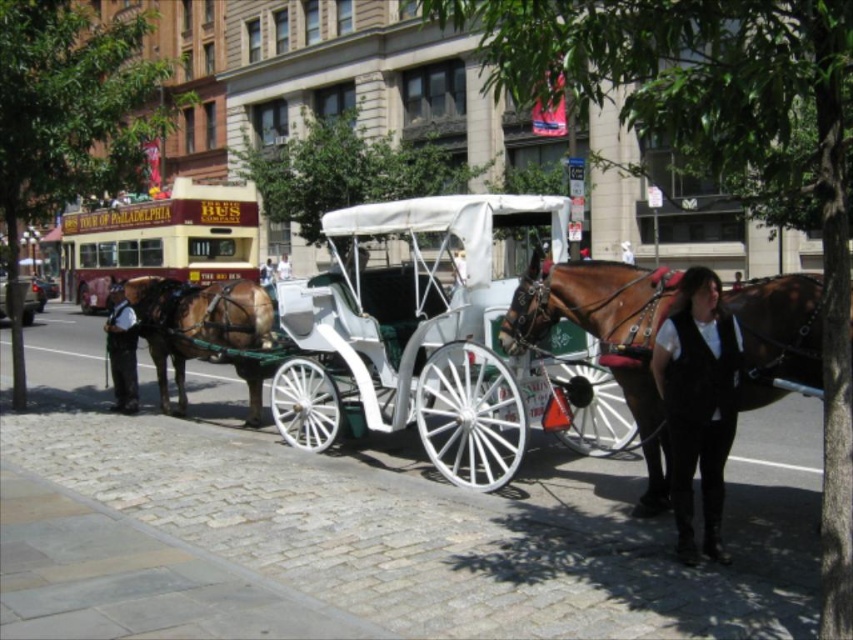
You are a tourist standing on the cobblestone street and want to take a photo of the shiny black coach at center and the brown glossy horse at center. Which object should you position to your left to frame both in the photo?

To frame both the shiny black coach at center and the brown glossy horse at center in your photo, position the shiny black coach at center to your left since the brown glossy horse at center is to the right of it.

You are standing at the origin point of the coordinate system in the image. The white polished wood coach at center is located at coordinates 0.630, 0.819. If you want to walk directly towards the coach, in which direction should you move relative to the image?

Since the white polished wood coach at center is located at coordinates [698,403], you should move towards the right and downward in the image to reach it.

You are a tourist standing on the cobblestone street and want to take a photo of the white polished wood coach at center and the brown glossy horse at left. Which object should you focus on first to ensure it appears larger in your photo?

The white polished wood coach at center is closer to the viewer than the brown glossy horse at left, so focusing on it first will make it appear larger in the photo.